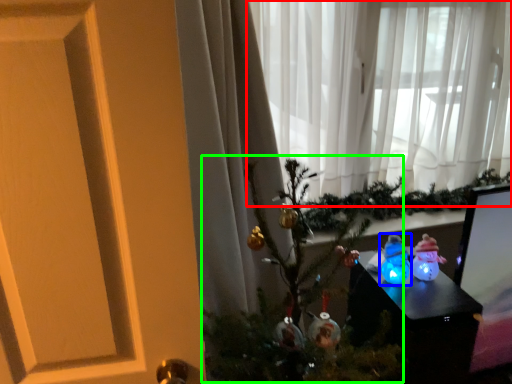
Question: Estimate the real-world distances between objects in this image. Which object is farther from curtain (highlighted by a red box), toy (highlighted by a blue box) or christmas tree (highlighted by a green box)?

Choices:
 (A) toy
 (B) christmas tree

Answer: (A)